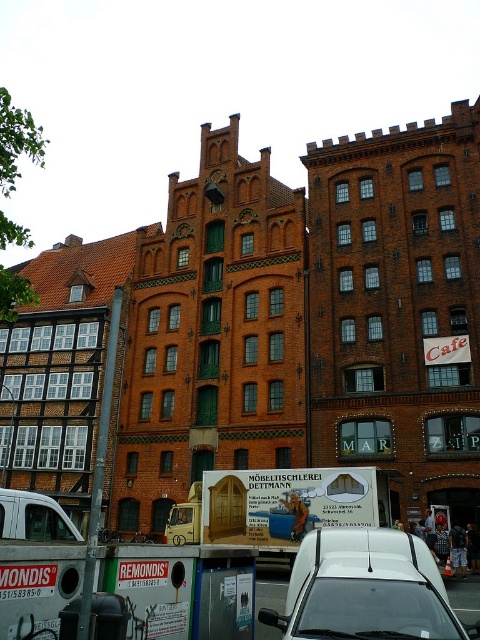
Where is `white matte van at center`? This screenshot has width=480, height=640. white matte van at center is located at coordinates (364, 588).

Is white matte van at center to the left of white matte van at lower left from the viewer's perspective?

Incorrect, white matte van at center is not on the left side of white matte van at lower left.

Where is `white matte van at center`? The image size is (480, 640). white matte van at center is located at coordinates click(364, 588).